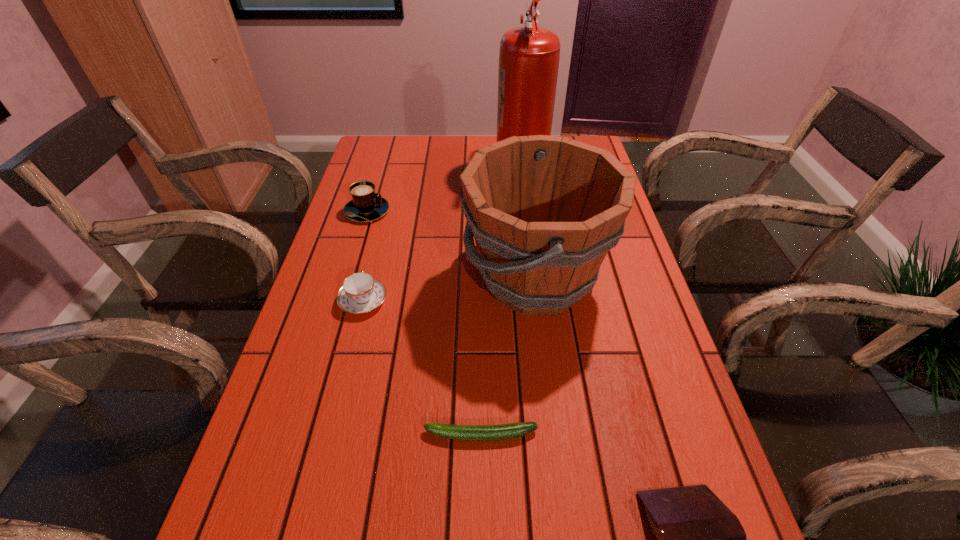
At what (x,y) coordinates should I click in order to perform the action: click on vacant space that's between the cappuccino and the teacup. Please return your answer as a coordinate pair (x, y). Image resolution: width=960 pixels, height=540 pixels. Looking at the image, I should click on (365, 256).

Locate an element on the screen. Image resolution: width=960 pixels, height=540 pixels. free space between the tallest object and the third tallest object is located at coordinates (444, 188).

I want to click on vacant space in between the tallest object and the fourth shortest object, so click(x=444, y=188).

The image size is (960, 540). Identify the location of object that is the third closest to the shortest object. click(x=360, y=293).

The image size is (960, 540). Find the location of `object that stands as the third closest to the cappuccino`. object that stands as the third closest to the cappuccino is located at coordinates (529, 56).